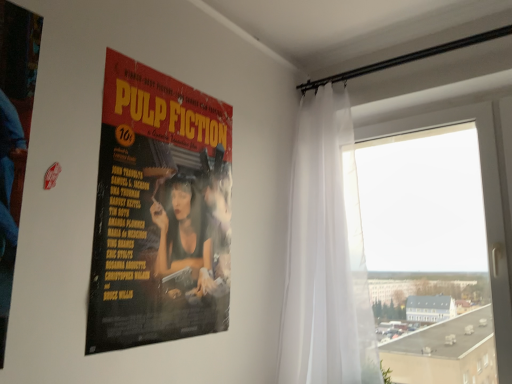
Question: Choose the correct answer: Is white sheer curtain at right inside transparent glass window at right or outside it?

Choices:
 (A) inside
 (B) outside

Answer: (B)

Question: Considering the positions of white sheer curtain at right and transparent glass window at right in the image, is white sheer curtain at right taller or shorter than transparent glass window at right?

Choices:
 (A) short
 (B) tall

Answer: (B)

Question: Which object is positioned farthest from the matte paper poster at center?

Choices:
 (A) transparent glass window at right
 (B) white sheer curtain at right

Answer: (A)

Question: Based on their relative distances, which object is nearer to the transparent glass window at right?

Choices:
 (A) white sheer curtain at right
 (B) matte paper poster at center

Answer: (A)